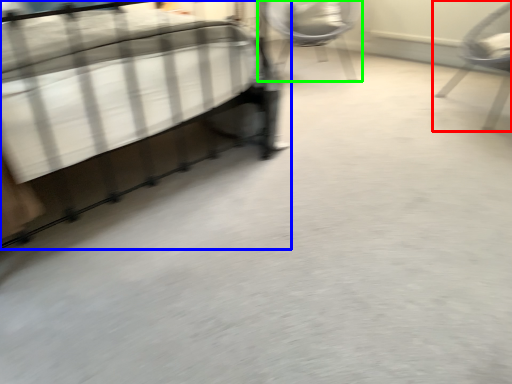
Question: Based on their relative distances, which object is nearer to chair (highlighted by a red box)? Choose from bed (highlighted by a blue box) and chair (highlighted by a green box).

Choices:
 (A) bed
 (B) chair

Answer: (B)